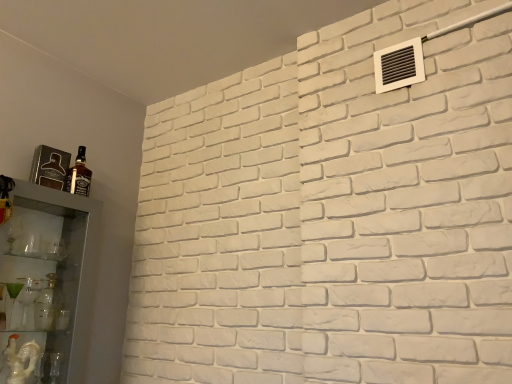
Question: Is matte glass bottle at left facing away from clear glass cabinet at left?

Choices:
 (A) yes
 (B) no

Answer: (B)

Question: Would you consider matte glass bottle at left to be distant from clear glass cabinet at left?

Choices:
 (A) no
 (B) yes

Answer: (A)

Question: Is matte glass bottle at left at the right side of clear glass cabinet at left?

Choices:
 (A) yes
 (B) no

Answer: (A)

Question: Does matte glass bottle at left have a greater height compared to clear glass cabinet at left?

Choices:
 (A) yes
 (B) no

Answer: (B)

Question: Considering the relative sizes of matte glass bottle at left and clear glass cabinet at left in the image provided, is matte glass bottle at left bigger than clear glass cabinet at left?

Choices:
 (A) yes
 (B) no

Answer: (B)

Question: Is clear glass cabinet at left bigger or smaller than matte glass bottle at left?

Choices:
 (A) small
 (B) big

Answer: (B)

Question: Is clear glass cabinet at left wider or thinner than matte glass bottle at left?

Choices:
 (A) thin
 (B) wide

Answer: (B)

Question: In the image, is clear glass cabinet at left positioned in front of or behind matte glass bottle at left?

Choices:
 (A) behind
 (B) front

Answer: (B)

Question: Considering the relative positions of clear glass cabinet at left and matte glass bottle at left in the image provided, is clear glass cabinet at left to the left or to the right of matte glass bottle at left?

Choices:
 (A) right
 (B) left

Answer: (B)

Question: From a real-world perspective, is clear glass cabinet at left physically located above or below white plastic vent at upper right?

Choices:
 (A) below
 (B) above

Answer: (A)

Question: Is point (24, 276) positioned closer to the camera than point (374, 54)?

Choices:
 (A) farther
 (B) closer

Answer: (A)

Question: In terms of height, does clear glass cabinet at left look taller or shorter compared to white plastic vent at upper right?

Choices:
 (A) tall
 (B) short

Answer: (A)

Question: Do you think clear glass cabinet at left is within white plastic vent at upper right, or outside of it?

Choices:
 (A) inside
 (B) outside

Answer: (B)

Question: Looking at their shapes, would you say white plastic vent at upper right is wider or thinner than matte glass bottle at left?

Choices:
 (A) thin
 (B) wide

Answer: (A)

Question: Considering the relative positions of white plastic vent at upper right and matte glass bottle at left in the image provided, is white plastic vent at upper right to the left or to the right of matte glass bottle at left?

Choices:
 (A) left
 (B) right

Answer: (B)